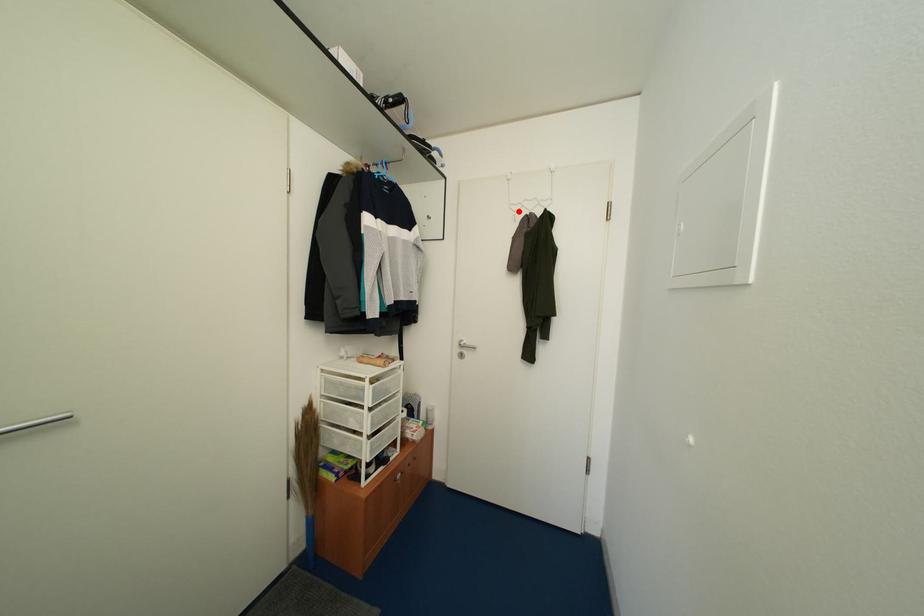
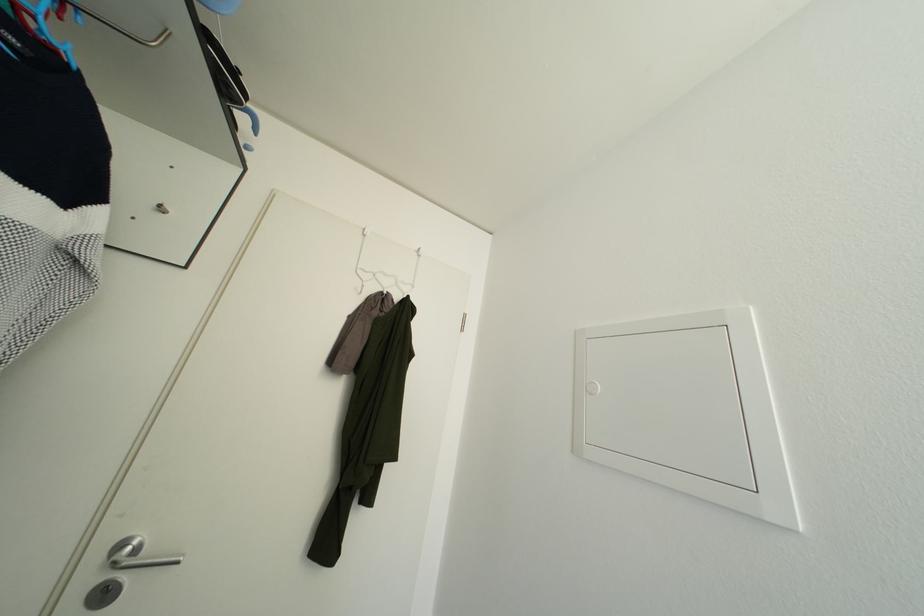
The point at the highlighted location is marked in the first image. Where is the corresponding point in the second image?

(366, 277)